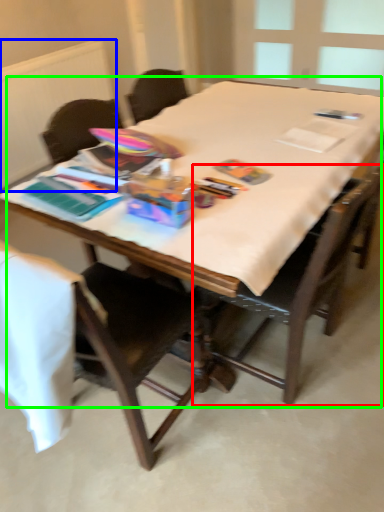
Question: Considering the real-world distances, which object is closest to chair (highlighted by a red box)? radiator (highlighted by a blue box) or table (highlighted by a green box).

Choices:
 (A) radiator
 (B) table

Answer: (B)